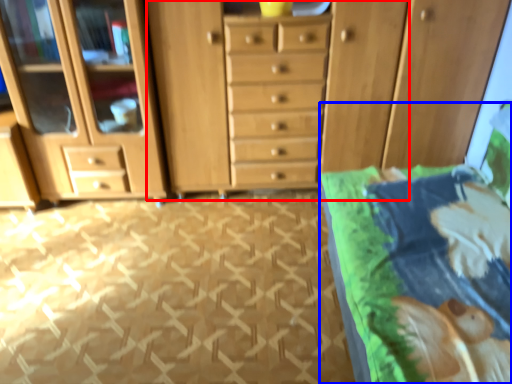
Question: Which object is closer to the camera taking this photo, dresser (highlighted by a red box) or bed (highlighted by a blue box)?

Choices:
 (A) dresser
 (B) bed

Answer: (B)